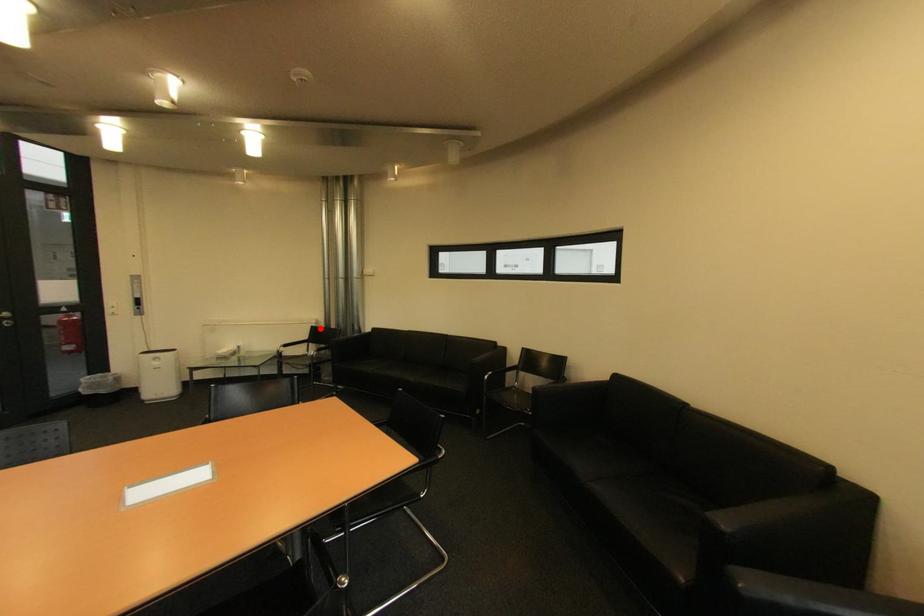
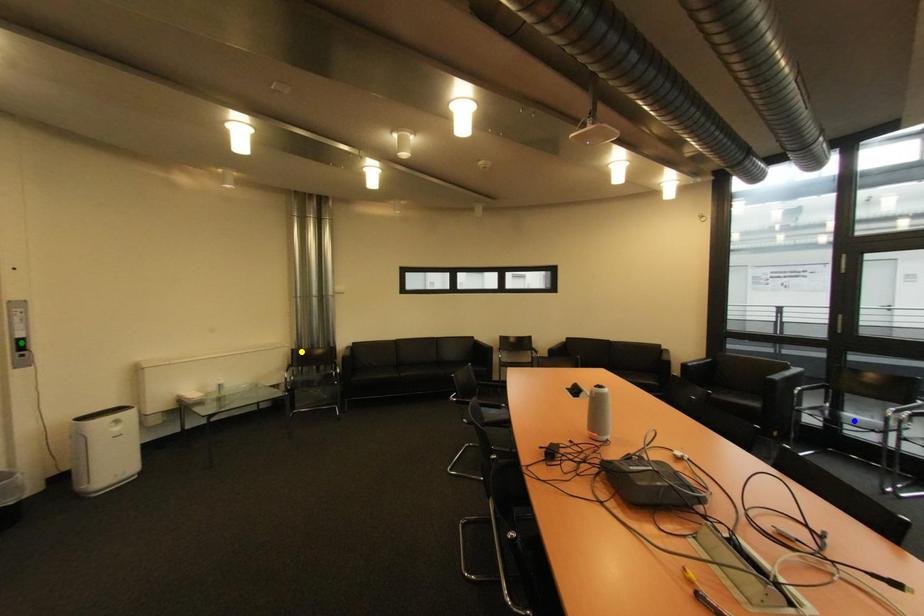
Question: I am providing you with two images of the same scene from different viewpoints. A red point is marked on the first image. You are given multiple points on the second image. Which mark in image 2 goes with the point in image 1?

Choices:
 (A) blue point
 (B) green point
 (C) yellow point

Answer: (C)